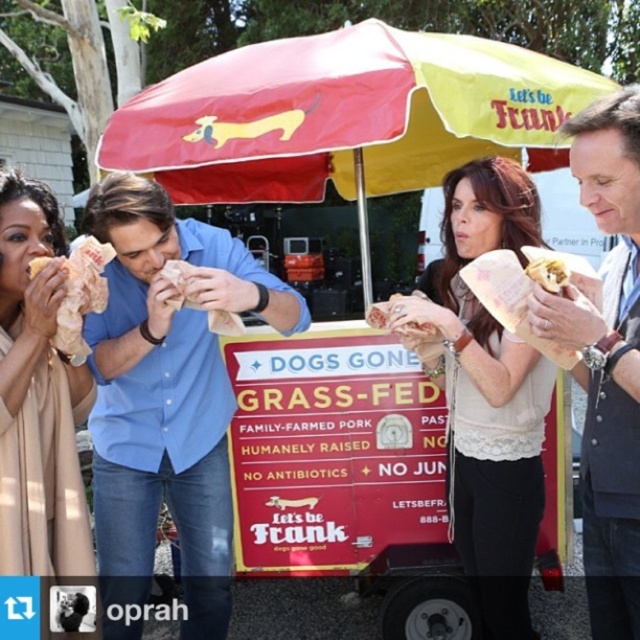
You are standing at the center of the image and want to grab the golden crispy chicken at left. In which direction should you move?

Since the golden crispy chicken at left is located at point [81,294], you should move to the left to reach it.

Please provide the 2D coordinates of the polyester umbrella at center in the image.

The polyester umbrella at center is located at coordinates point (344, 115).